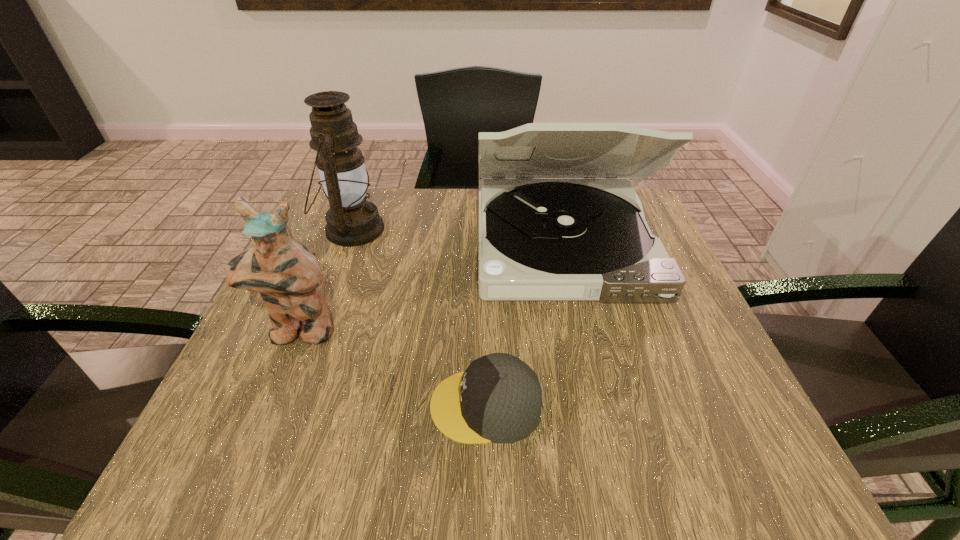
The image size is (960, 540). Find the location of `free space at the near edge`. free space at the near edge is located at coordinates coord(312,469).

Identify the location of vacant region at the far left corner. (371, 195).

Where is `vacant space at the near left corner`? vacant space at the near left corner is located at coordinates (211, 437).

The width and height of the screenshot is (960, 540). I want to click on vacant area that lies between the CD player and the shortest object, so click(524, 324).

Locate an element on the screen. This screenshot has height=540, width=960. vacant area that lies between the third farthest object and the nearest object is located at coordinates click(x=392, y=369).

This screenshot has width=960, height=540. In order to click on free space between the CD player and the shortest object in this screenshot , I will do `click(524, 324)`.

Identify the location of vacant area between the CD player and the cap. The height and width of the screenshot is (540, 960). (524, 324).

Where is `free point between the nearest object and the oil lamp`? The height and width of the screenshot is (540, 960). free point between the nearest object and the oil lamp is located at coordinates (419, 318).

The image size is (960, 540). What are the coordinates of `free space that is in between the oil lamp and the nearest object` in the screenshot? It's located at click(419, 318).

Find the location of `free space between the CD player and the oil lamp`. free space between the CD player and the oil lamp is located at coordinates (458, 236).